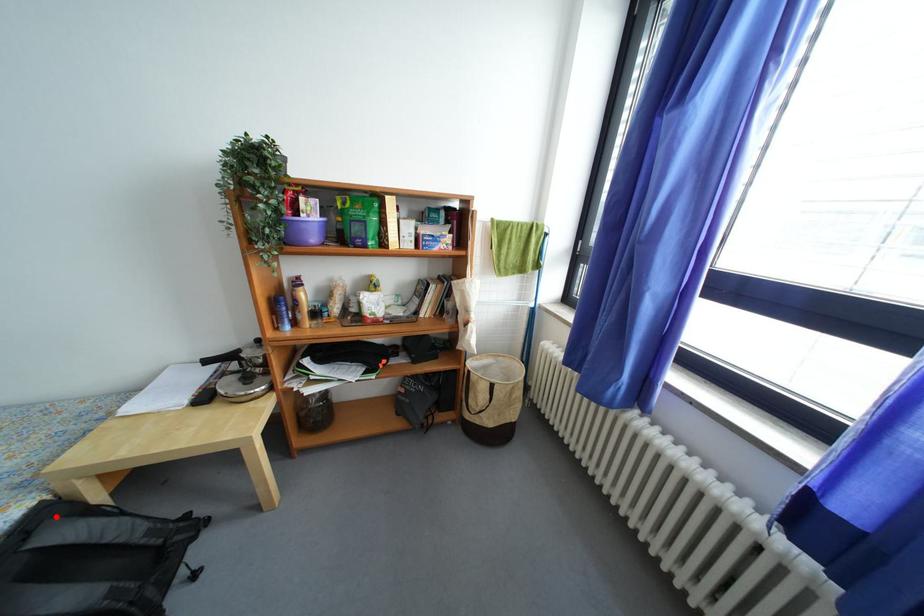
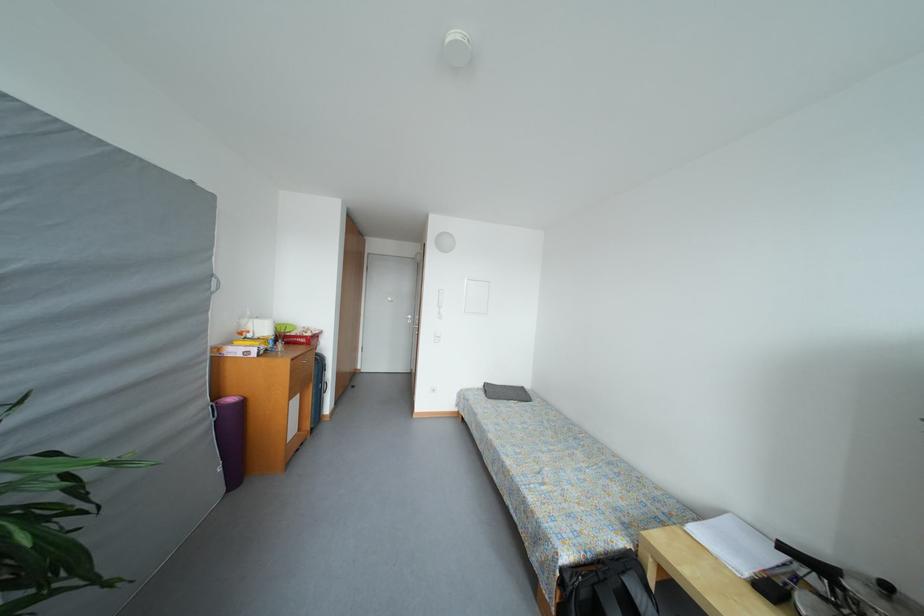
Where in the second image is the point corresponding to the highlighted location from the first image?

(638, 567)